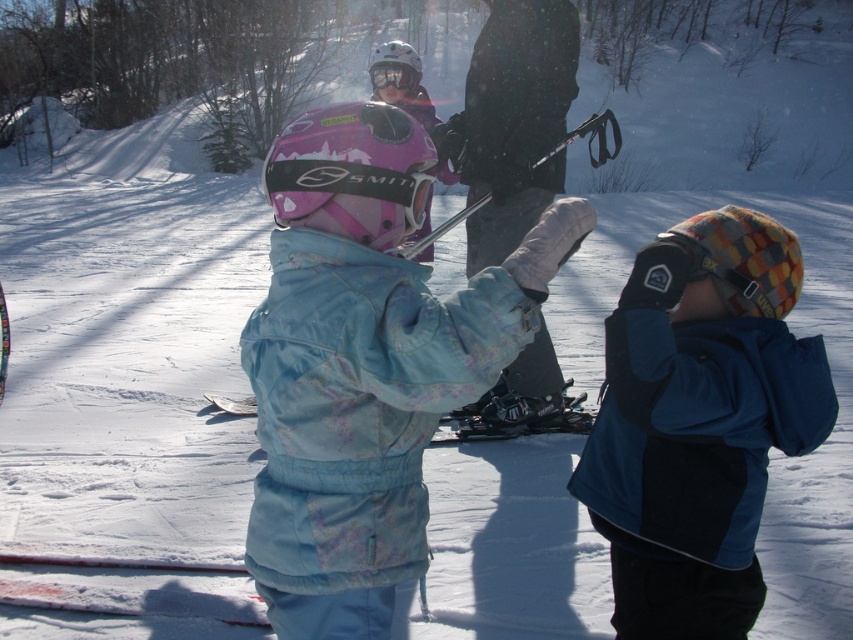
Which is below, red plastic ski at lower left or multicolored knitted hat at right?

Positioned lower is red plastic ski at lower left.

Does red plastic ski at lower left have a greater width compared to multicolored knitted hat at right?

Yes.

Does point (119, 604) come farther from viewer compared to point (685, 248)?

Yes, it is.

Locate an element on the screen. This screenshot has width=853, height=640. red plastic ski at lower left is located at coordinates (128, 588).

Who is taller, pink matte helmet at center or matte pink helmet at upper center?

matte pink helmet at upper center

Does pink matte helmet at center appear under matte pink helmet at upper center?

Yes.

I want to click on pink matte helmet at center, so click(x=352, y=173).

Does red plastic ski at lower left have a lesser height compared to matte pink goggles at center?

Indeed, red plastic ski at lower left has a lesser height compared to matte pink goggles at center.

Does red plastic ski at lower left appear over matte pink goggles at center?

Actually, red plastic ski at lower left is below matte pink goggles at center.

The image size is (853, 640). What do you see at coordinates (128, 588) in the screenshot?
I see `red plastic ski at lower left` at bounding box center [128, 588].

The height and width of the screenshot is (640, 853). What are the coordinates of `red plastic ski at lower left` in the screenshot? It's located at (128, 588).